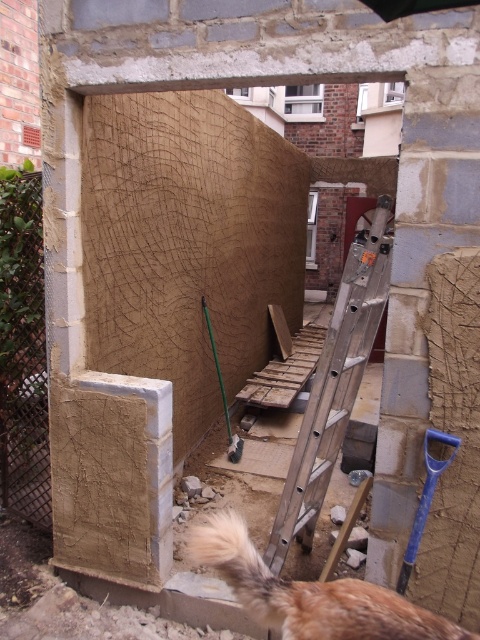
Question: Which of the following is the farthest from the observer?

Choices:
 (A) silver metallic ladder at center
 (B) brown fluffy tail at lower center
 (C) blue plastic shovel at lower right

Answer: (A)

Question: Which of the following is the closest to the observer?

Choices:
 (A) silver metallic ladder at center
 (B) brown fluffy tail at lower center
 (C) green plastic shovel at center

Answer: (B)

Question: Among these points, which one is nearest to the camera?

Choices:
 (A) (420, 529)
 (B) (203, 310)
 (C) (360, 330)

Answer: (A)

Question: Is silver metallic ladder at center in front of green plastic shovel at center?

Choices:
 (A) yes
 (B) no

Answer: (A)

Question: Does brown fluffy tail at lower center have a smaller size compared to blue plastic shovel at lower right?

Choices:
 (A) no
 (B) yes

Answer: (A)

Question: Is blue plastic shovel at lower right above green plastic shovel at center?

Choices:
 (A) yes
 (B) no

Answer: (B)